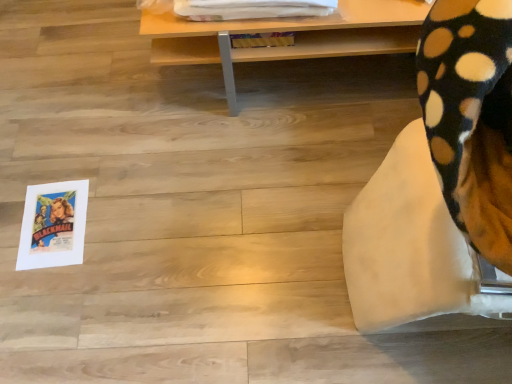
Identify the location of free space to the left of wooden table at upper center. (91, 107).